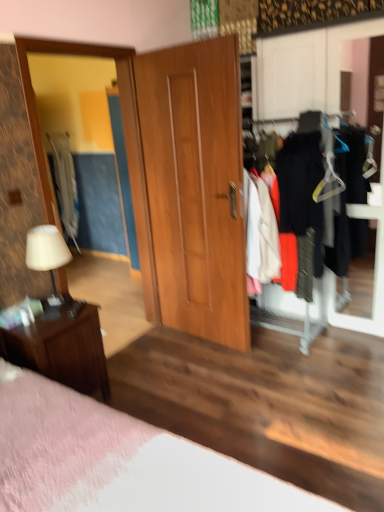
Where is `free location above brown wood nightstand at lower left (from a real-world perspective)`? Image resolution: width=384 pixels, height=512 pixels. free location above brown wood nightstand at lower left (from a real-world perspective) is located at coordinates (49, 308).